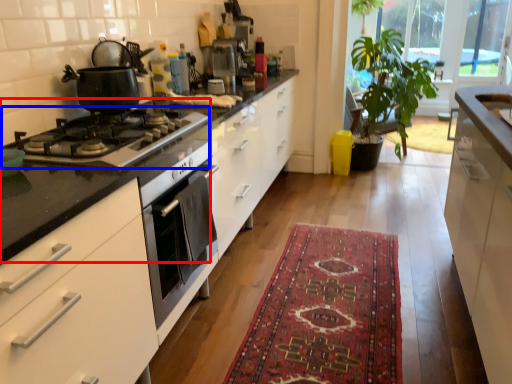
Question: Which point is closer to the camera, gas stove (highlighted by a red box) or gas stove (highlighted by a blue box)?

Choices:
 (A) gas stove
 (B) gas stove

Answer: (B)